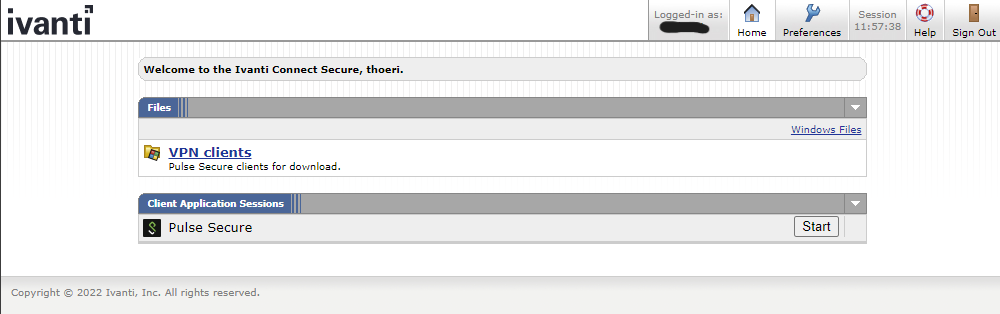
Find the location of a particular element. door is located at coordinates (974, 13).